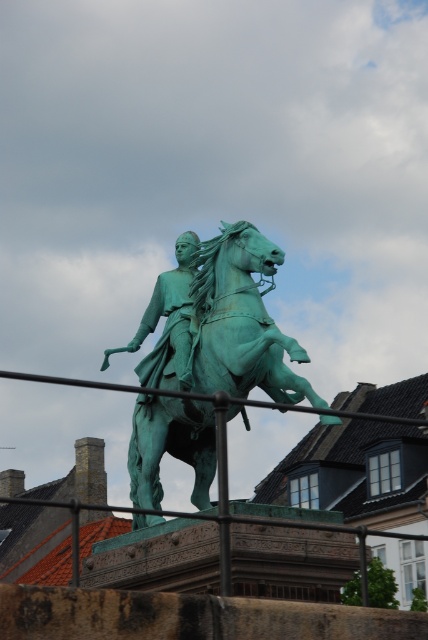
You are a photographer trying to capture the equestrian statue. To ensure the rustic metal fence at center is in the frame, where should you position your camera relative to the statue?

The rustic metal fence at center is located at point [68,381] in the image, which means it is positioned slightly to the right and near the bottom of the frame. To include it in your photo, position your camera so that it captures the lower central area of the statue.

You are a painter standing at the base of the green patinated statue at center, wanting to paint the rustic metal fence at center. Can you see the entire fence without moving your position?

The rustic metal fence at center might be wider than green patinated statue at center, so you might not be able to see the entire fence from your current position unless you move to get a wider view.